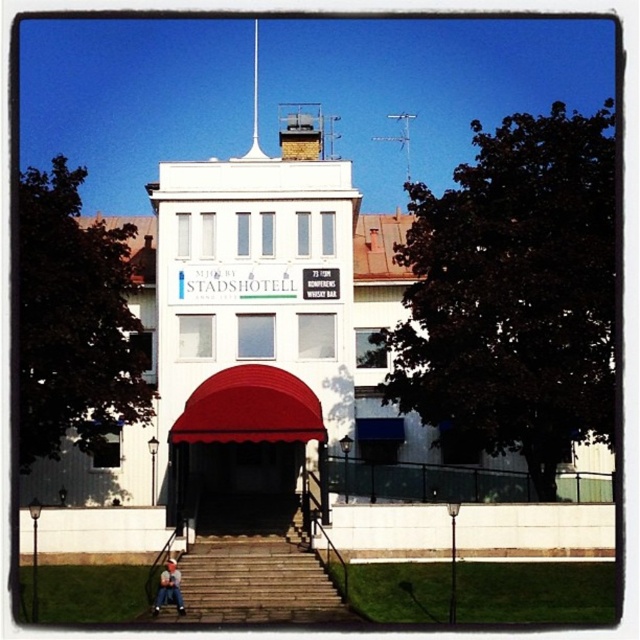
Is stone stairs at center smaller than blue denim jeans at lower center?

No.

Does stone stairs at center have a larger size compared to blue denim jeans at lower center?

Yes, stone stairs at center is bigger than blue denim jeans at lower center.

Is point (348, 605) closer to viewer compared to point (177, 589)?

Yes.

Identify the location of stone stairs at center. (257, 582).

Which is below, red fabric awning at center or blue denim jeans at lower center?

blue denim jeans at lower center is lower down.

Does red fabric awning at center have a greater width compared to blue denim jeans at lower center?

Yes, red fabric awning at center is wider than blue denim jeans at lower center.

Between point (176, 429) and point (163, 589), which one is positioned behind?

Point (176, 429)

At what (x,y) coordinates should I click in order to perform the action: click on red fabric awning at center. Please return your answer as a coordinate pair (x, y). Looking at the image, I should click on (250, 408).

Can you confirm if stone stairs at center is positioned above red fabric awning at center?

No.

This screenshot has height=640, width=640. I want to click on stone stairs at center, so click(257, 582).

This screenshot has height=640, width=640. I want to click on stone stairs at center, so click(x=257, y=582).